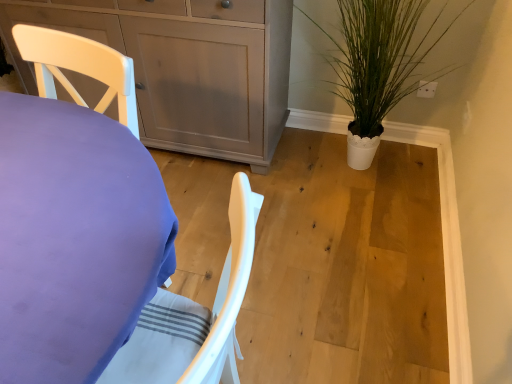
Question: In terms of width, does matte gray cabinet at upper left look wider or thinner when compared to purple fabric-covered desk at left?

Choices:
 (A) thin
 (B) wide

Answer: (A)

Question: Is matte gray cabinet at upper left to the left or to the right of purple fabric-covered desk at left in the image?

Choices:
 (A) right
 (B) left

Answer: (A)

Question: Which of these objects is positioned closest to the purple fabric-covered desk at left?

Choices:
 (A) white matte pot at right
 (B) matte gray cabinet at upper left

Answer: (B)

Question: Estimate the real-world distances between objects in this image. Which object is closer to the purple fabric-covered desk at left?

Choices:
 (A) white matte pot at right
 (B) matte gray cabinet at upper left

Answer: (B)